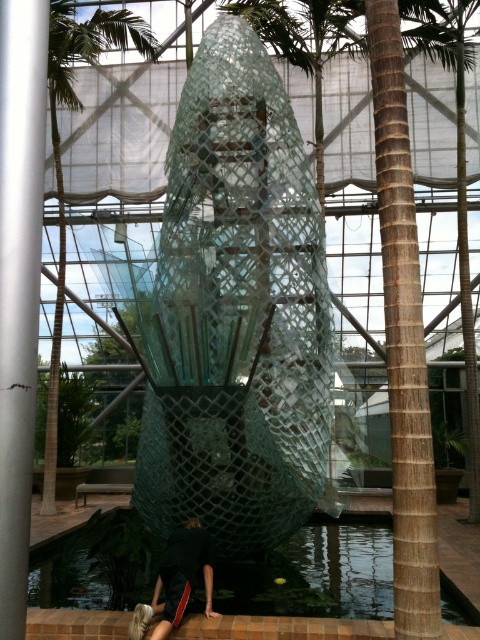
Is green leafy palm tree at left smaller than brown textured palm tree at right?

Actually, green leafy palm tree at left might be larger than brown textured palm tree at right.

Is green leafy palm tree at left below brown textured palm tree at right?

No, green leafy palm tree at left is not below brown textured palm tree at right.

Is point (87, 42) positioned before point (407, 1)?

No, it is not.

The width and height of the screenshot is (480, 640). Find the location of `green leafy palm tree at left`. green leafy palm tree at left is located at coordinates (60, 163).

Is transparent mesh sculpture at center below silver metallic pole at left?

No.

Is transparent mesh sculpture at center bigger than silver metallic pole at left?

Yes, transparent mesh sculpture at center is bigger than silver metallic pole at left.

Where is `transparent mesh sculpture at center`? The image size is (480, 640). transparent mesh sculpture at center is located at coordinates (237, 312).

Is silver metallic pole at left positioned behind black fabric at lower center?

No, it is not.

Where is `silver metallic pole at left`? silver metallic pole at left is located at coordinates (19, 284).

Does point (22, 182) lie in front of point (156, 604)?

Yes, it is in front of point (156, 604).

Locate an element on the screen. silver metallic pole at left is located at coordinates (19, 284).